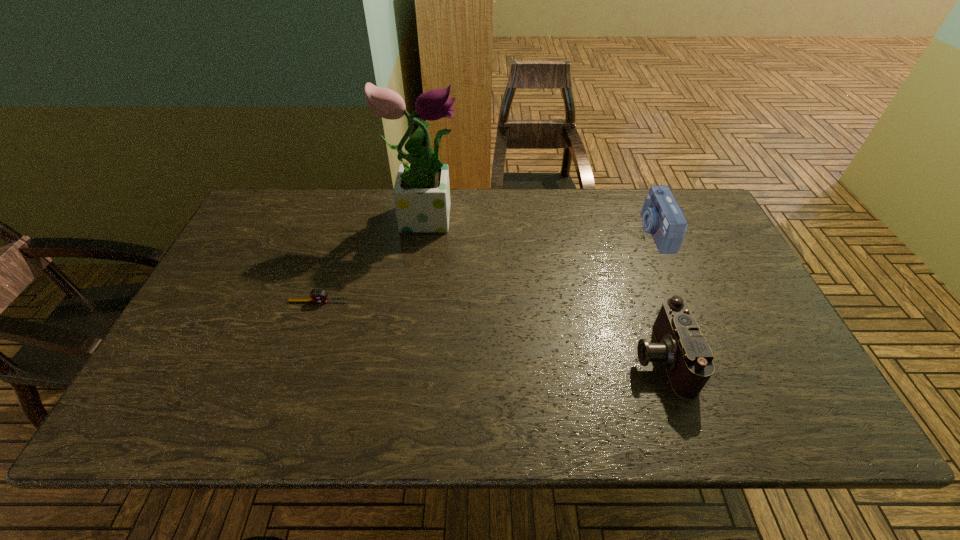
Locate an element on the screen. This screenshot has height=540, width=960. free space located 0.380m on the lens of the rightmost object is located at coordinates (518, 232).

Image resolution: width=960 pixels, height=540 pixels. What are the coordinates of `free spot located 0.320m on the lens of the rightmost object` in the screenshot? It's located at (539, 232).

At what (x,y) coordinates should I click in order to perform the action: click on vacant area situated on the front-facing side of the nearer camera. Please return your answer as a coordinate pair (x, y). The width and height of the screenshot is (960, 540). Looking at the image, I should click on (468, 357).

Locate an element on the screen. vacant area located 0.160m on the front-facing side of the nearer camera is located at coordinates (565, 357).

Locate an element on the screen. The height and width of the screenshot is (540, 960). free space located 0.230m on the front-facing side of the nearer camera is located at coordinates (536, 357).

In order to click on vacant region located on the back of the leftmost object in this screenshot , I will do `click(349, 208)`.

Where is `flower arrangement that is at the far edge`? flower arrangement that is at the far edge is located at coordinates (421, 193).

Locate an element on the screen. Image resolution: width=960 pixels, height=540 pixels. camera that is at the far edge is located at coordinates (662, 217).

Locate an element on the screen. The width and height of the screenshot is (960, 540). object situated at the near edge is located at coordinates (686, 354).

In order to click on object located at the right edge in this screenshot , I will do `click(662, 217)`.